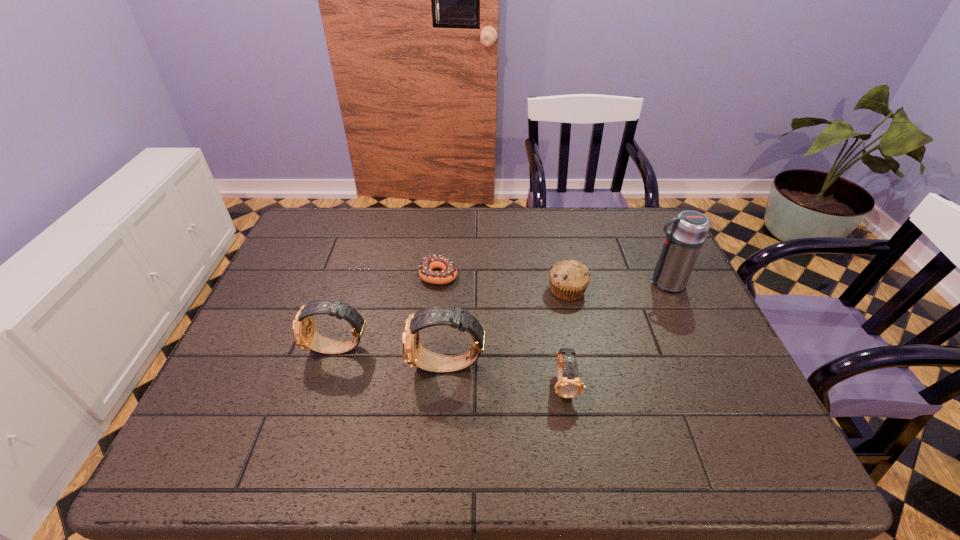
Please point out where to position a new watch on the right to maintain spacing. Please provide its 2D coordinates. Your answer should be formatted as a tuple, i.e. [(x, y)], where the tuple contains the x and y coordinates of a point satisfying the conditions above.

[(691, 404)]